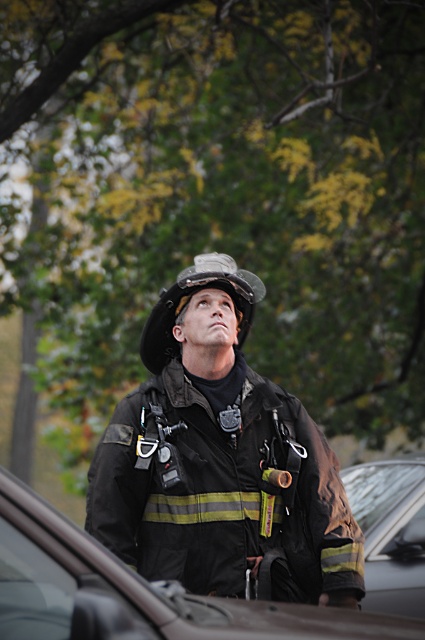
Is point (22, 492) positioned before point (243, 317)?

Yes, point (22, 492) is in front of point (243, 317).

Is black glossy car at center wider than black matte helmet at center?

Yes.

You are a GUI agent. You are given a task and a screenshot of the screen. Output one action in this format:
    pyautogui.click(x=<x>, y=<y>)
    Task: Click on the black glossy car at center
    This screenshot has height=640, width=425.
    Given the screenshot: What is the action you would take?
    pyautogui.click(x=136, y=593)

Measure the distance from black matte uniform at center to transparent glass car window at lower left.

black matte uniform at center is 9.28 feet away from transparent glass car window at lower left.

Which is below, black matte uniform at center or transparent glass car window at lower left?

transparent glass car window at lower left is lower down.

Is point (291, 476) closer to viewer compared to point (31, 600)?

No.

Locate an element on the screen. black matte uniform at center is located at coordinates (220, 460).

Is black glossy car at center smaller than transparent glass car window at lower left?

No, black glossy car at center is not smaller than transparent glass car window at lower left.

Is point (306, 628) positioned after point (11, 529)?

Yes, point (306, 628) is farther from viewer.

Where is `black glossy car at center`? black glossy car at center is located at coordinates (136, 593).